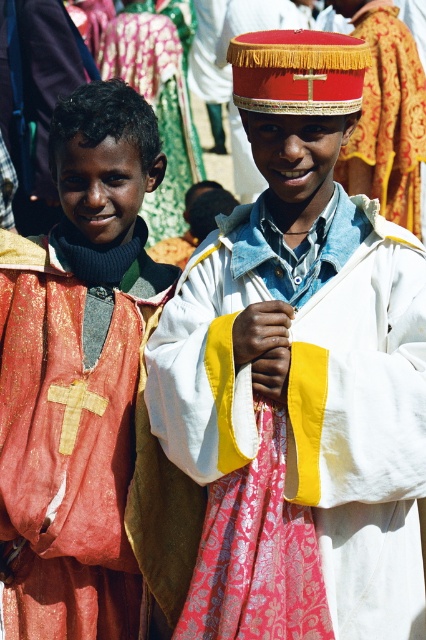
Does white/yellow fabric vest at center appear on the right side of shiny red vest at left?

Indeed, white/yellow fabric vest at center is positioned on the right side of shiny red vest at left.

Where is `white/yellow fabric vest at center`? This screenshot has width=426, height=640. white/yellow fabric vest at center is located at coordinates (307, 337).

Between point (319, 282) and point (34, 636), which one is positioned in front?

Positioned in front is point (319, 282).

Where is `white/yellow fabric vest at center`? Image resolution: width=426 pixels, height=640 pixels. white/yellow fabric vest at center is located at coordinates (307, 337).